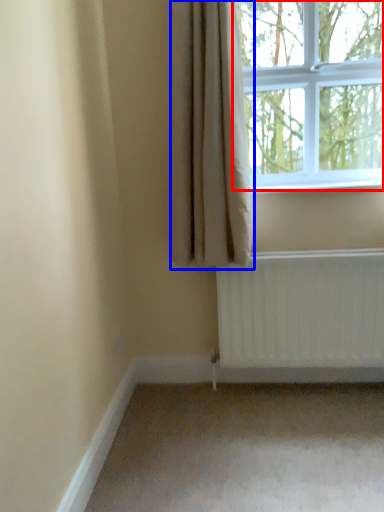
Question: Among these objects, which one is nearest to the camera, window (highlighted by a red box) or curtain (highlighted by a blue box)?

Choices:
 (A) window
 (B) curtain

Answer: (B)